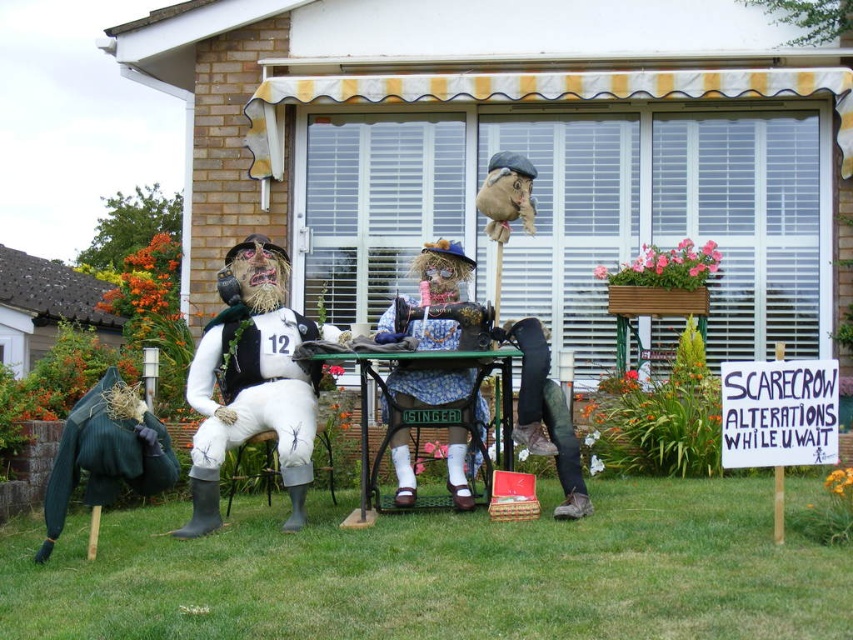
Question: Which point is farther to the camera?

Choices:
 (A) green grass at lower center
 (B) white fabric scarecrow at center
 (C) green metal table at center
 (D) matte white rubber boots at left

Answer: (B)

Question: Which of the following is the farthest from the observer?

Choices:
 (A) (492, 608)
 (B) (293, 413)
 (C) (254, 381)

Answer: (C)

Question: Can you confirm if white fabric scarecrow at center is bigger than green metal table at center?

Choices:
 (A) no
 (B) yes

Answer: (A)

Question: Based on their relative distances, which object is nearer to the blue floral fabric at center?

Choices:
 (A) green metal table at center
 (B) matte white rubber boots at left

Answer: (A)

Question: Does matte white rubber boots at left have a greater width compared to blue floral fabric at center?

Choices:
 (A) no
 (B) yes

Answer: (B)

Question: Where is green grass at lower center located in relation to blue floral fabric at center in the image?

Choices:
 (A) below
 (B) above

Answer: (A)